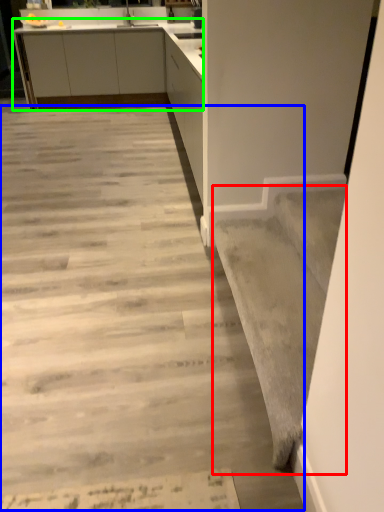
Question: Which object is the closest to the stairwell (highlighted by a red box)? Choose among these: concrete (highlighted by a blue box) or cabinetry (highlighted by a green box).

Choices:
 (A) concrete
 (B) cabinetry

Answer: (A)